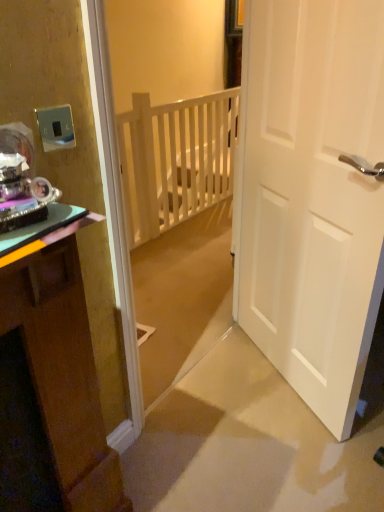
Question: Relative to metallic silver switch at upper left, is green glossy cabinet at left in front or behind?

Choices:
 (A) behind
 (B) front

Answer: (B)

Question: Based on their positions, is green glossy cabinet at left located to the left or right of metallic silver switch at upper left?

Choices:
 (A) left
 (B) right

Answer: (A)

Question: Considering the real-world distances, which object is closest to the metallic silver switch at upper left?

Choices:
 (A) white matte door at right
 (B) green glossy cabinet at left
 (C) white wooden balustrade at center

Answer: (B)

Question: Which of these objects is positioned closest to the white matte door at right?

Choices:
 (A) white wooden balustrade at center
 (B) metallic silver switch at upper left
 (C) green glossy cabinet at left

Answer: (C)